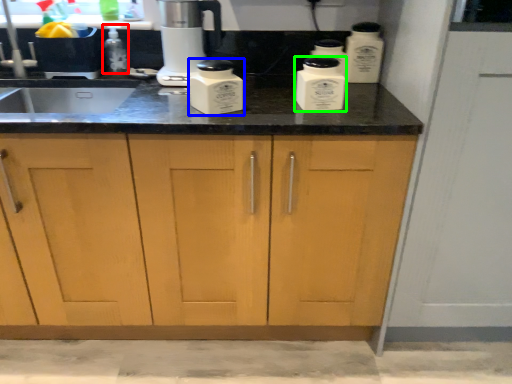
Question: Considering the real-world distances, which object is farthest from bottle (highlighted by a red box)? kitchen appliance (highlighted by a blue box) or kitchen appliance (highlighted by a green box)?

Choices:
 (A) kitchen appliance
 (B) kitchen appliance

Answer: (B)